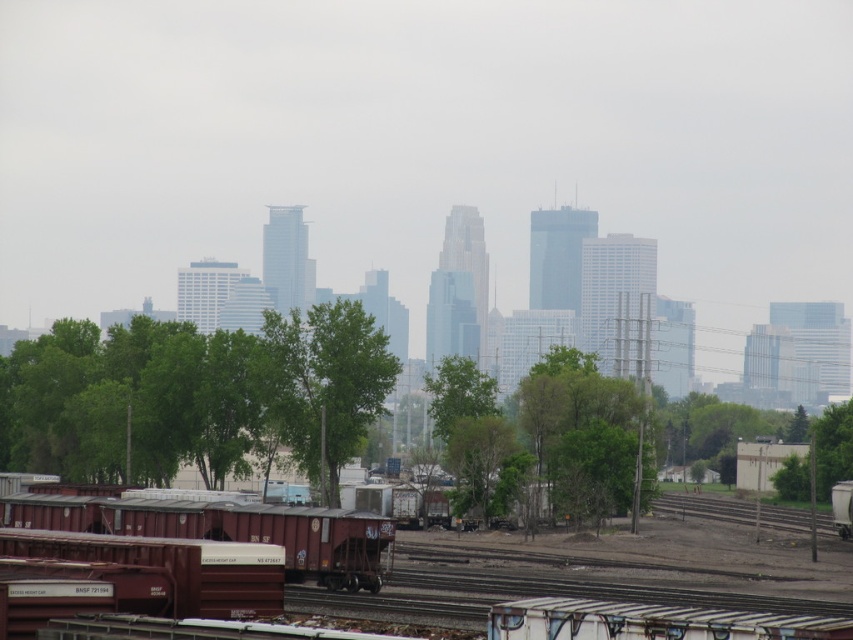
Question: Among these objects, which one is farthest from the camera?

Choices:
 (A) green leafy tree at center-right
 (B) green leafy tree at lower center
 (C) rusty metal train car at lower left
 (D) rusty metal train car at center

Answer: (A)

Question: Can you confirm if rusty metal train car at center is bigger than green leafy tree at center-right?

Choices:
 (A) yes
 (B) no

Answer: (A)

Question: Which point is closer to the camera?

Choices:
 (A) (462, 502)
 (B) (706, 396)

Answer: (A)

Question: Based on their relative distances, which object is nearer to the green leafy tree at lower center?

Choices:
 (A) green leafy tree at center-right
 (B) green leafy tree at center
 (C) green matte tree at center

Answer: (B)

Question: Does green leafy tree at center have a greater width compared to green leafy tree at center-right?

Choices:
 (A) no
 (B) yes

Answer: (B)

Question: Observing the image, what is the correct spatial positioning of green leafy tree at center in reference to rusty metal train car at lower left?

Choices:
 (A) below
 (B) above

Answer: (B)